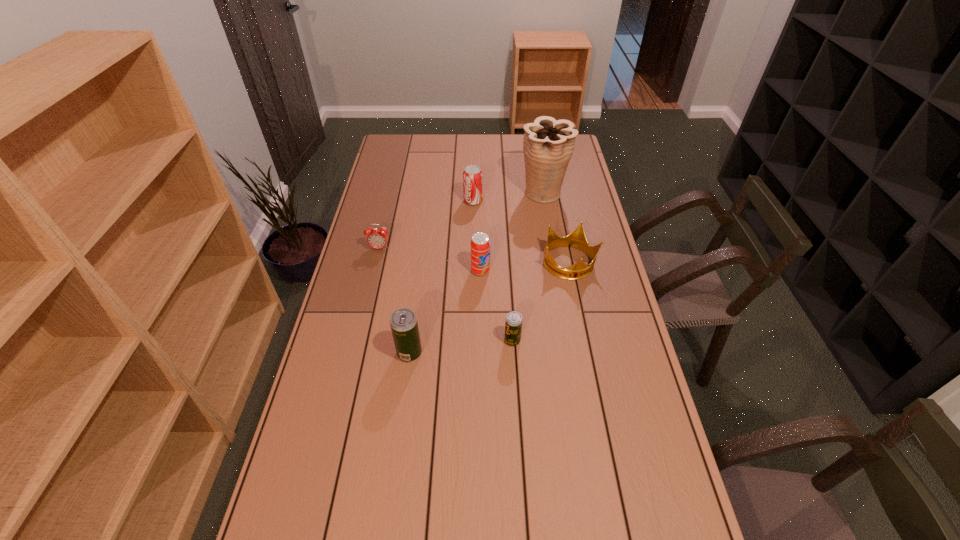
Locate an element on the screen. vacant area that lies between the shorter beer can and the leftmost object is located at coordinates (445, 294).

Locate an element on the screen. The height and width of the screenshot is (540, 960). vacant point located between the third object from right to left and the farther soda can is located at coordinates (492, 271).

Identify the location of free space between the farther soda can and the second object from left to right. (442, 277).

Where is `object that can be found as the third closest to the alarm clock`? This screenshot has width=960, height=540. object that can be found as the third closest to the alarm clock is located at coordinates (403, 322).

Locate an element on the screen. The height and width of the screenshot is (540, 960). object that ranks as the third closest to the fifth object from left to right is located at coordinates (480, 243).

Identify the location of vacant space that satisfies the following two spatial constraints: 1. on the back side of the crown; 2. on the left side of the sixth object from right to left. This screenshot has height=540, width=960. (421, 263).

Locate an element on the screen. Image resolution: width=960 pixels, height=540 pixels. vacant space that satisfies the following two spatial constraints: 1. on the face of the sixth object from right to left; 2. on the right side of the leftmost object is located at coordinates (355, 353).

What are the coordinates of `free spot that satisfies the following two spatial constraints: 1. on the logo side of the farther soda can; 2. on the face of the leftmost object` in the screenshot? It's located at (472, 248).

This screenshot has width=960, height=540. I want to click on free space that satisfies the following two spatial constraints: 1. on the front side of the shorter beer can; 2. on the right side of the nearer soda can, so click(481, 341).